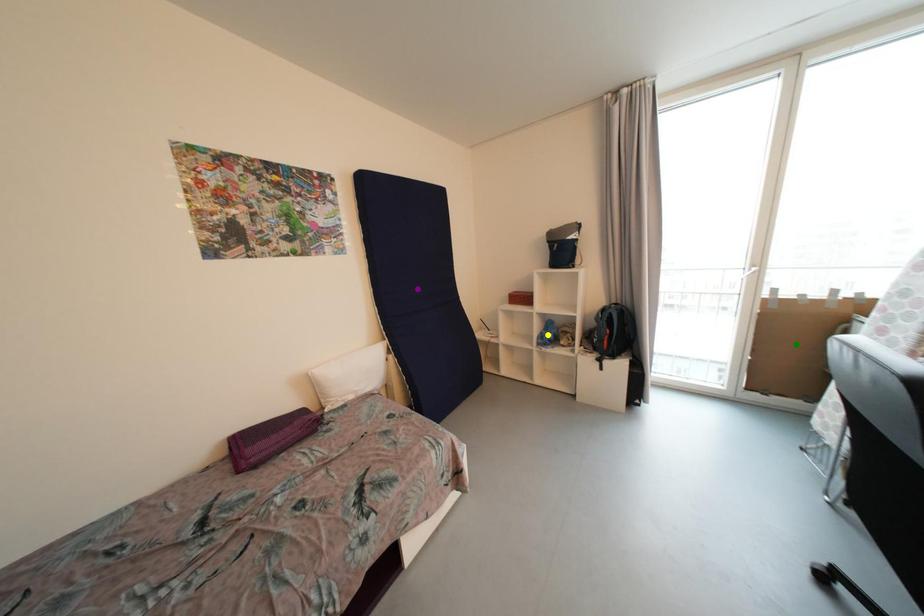
Order these from nearest to farthest:
1. purple point
2. yellow point
3. green point

green point → purple point → yellow point